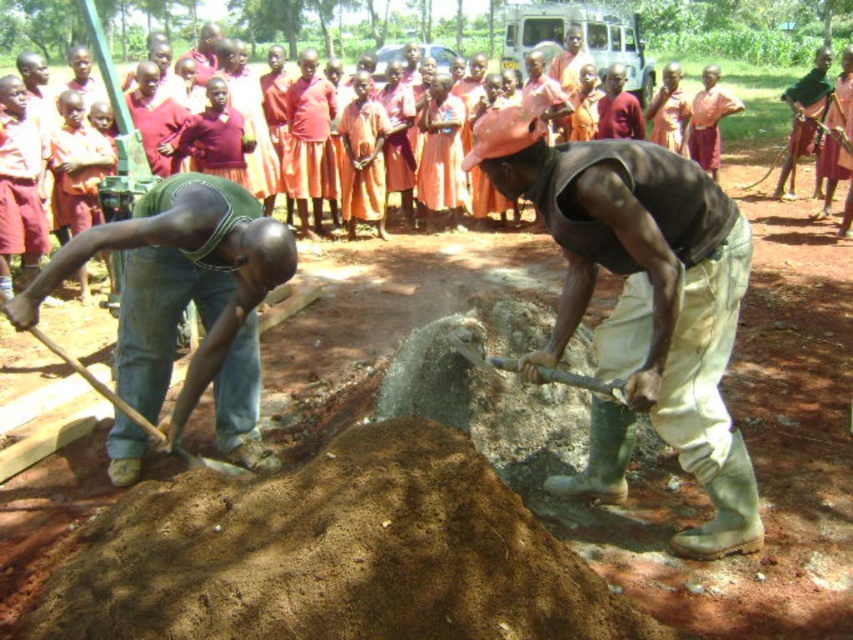
Who is more forward, [363,536] or [730,332]?

Point [363,536]

Image resolution: width=853 pixels, height=640 pixels. Find the location of `brown dirt mound at center`. brown dirt mound at center is located at coordinates (334, 556).

Image resolution: width=853 pixels, height=640 pixels. I want to click on brown dirt mound at center, so click(x=334, y=556).

Does wooden handle shovel at lower left have a larger size compared to wooden shovel at center?

Correct, wooden handle shovel at lower left is larger in size than wooden shovel at center.

Who is taller, wooden handle shovel at lower left or wooden shovel at center?

wooden handle shovel at lower left is taller.

This screenshot has height=640, width=853. Describe the element at coordinates (135, 412) in the screenshot. I see `wooden handle shovel at lower left` at that location.

Locate an element on the screen. This screenshot has width=853, height=640. wooden handle shovel at lower left is located at coordinates (135, 412).

Can you confirm if brown dirt mound at center is wider than wooden shovel at center?

Yes.

Who is more forward, [457,612] or [517,369]?

Answer: Point [457,612] is in front.

Who is more forward, (434, 568) or (469, 342)?

Point (434, 568) is in front.

Locate an element on the screen. The width and height of the screenshot is (853, 640). brown dirt mound at center is located at coordinates (334, 556).